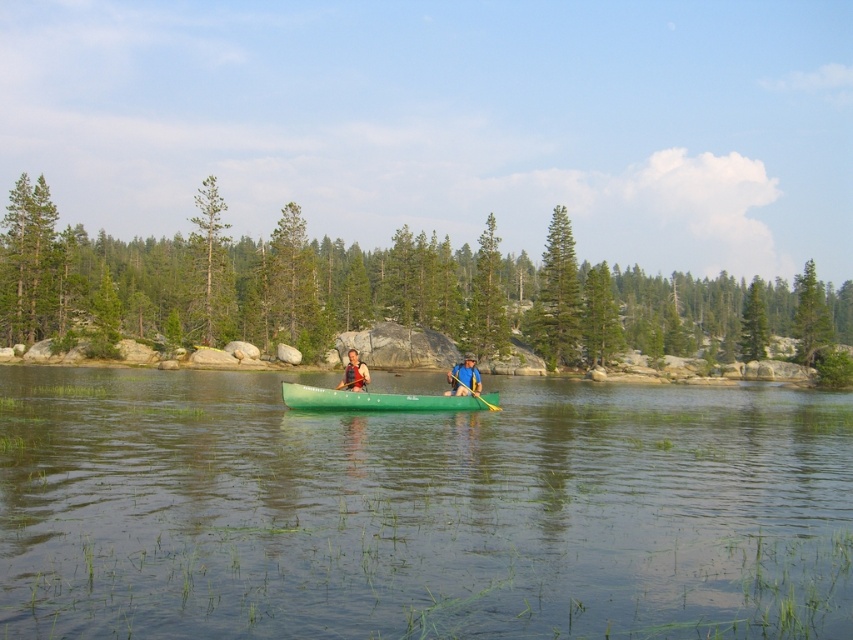
Is green plastic canoe at center below green plastic paddle at center?

No, green plastic canoe at center is not below green plastic paddle at center.

Can you confirm if green plastic canoe at center is positioned to the right of green plastic paddle at center?

No, green plastic canoe at center is not to the right of green plastic paddle at center.

In order to click on green plastic canoe at center in this screenshot , I will do `click(379, 401)`.

Is the position of matte green canoe at center less distant than that of green plastic paddle at center?

Yes, it is in front of green plastic paddle at center.

Can you confirm if matte green canoe at center is shorter than green plastic paddle at center?

Yes.

Who is more forward, (349,369) or (471,392)?

Point (349,369) is in front.

Where is `matte green canoe at center`? matte green canoe at center is located at coordinates (354, 372).

Does clear water at center have a lesser height compared to matte green canoe at center?

No.

Measure the distance between clear water at center and matte green canoe at center.

9.71 meters

The height and width of the screenshot is (640, 853). Describe the element at coordinates (419, 512) in the screenshot. I see `clear water at center` at that location.

This screenshot has height=640, width=853. In order to click on clear water at center in this screenshot , I will do `click(419, 512)`.